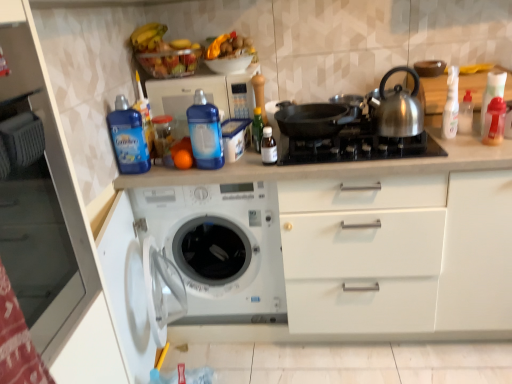
Question: Is blue plastic microwave at upper center taller than black matte pan at center?

Choices:
 (A) no
 (B) yes

Answer: (B)

Question: Considering the relative sizes of blue plastic microwave at upper center and black matte pan at center in the image provided, is blue plastic microwave at upper center bigger than black matte pan at center?

Choices:
 (A) no
 (B) yes

Answer: (B)

Question: Is blue plastic microwave at upper center placed right next to black matte pan at center?

Choices:
 (A) no
 (B) yes

Answer: (A)

Question: From the image's perspective, does blue plastic microwave at upper center appear lower than black matte pan at center?

Choices:
 (A) yes
 (B) no

Answer: (B)

Question: Is blue plastic microwave at upper center aimed at black matte pan at center?

Choices:
 (A) yes
 (B) no

Answer: (B)

Question: From the image's perspective, is shiny metallic kettle at upper right above or below black matte frying pan at center?

Choices:
 (A) above
 (B) below

Answer: (A)

Question: Is point tap(388, 110) positioned closer to the camera than point tap(297, 122)?

Choices:
 (A) farther
 (B) closer

Answer: (B)

Question: Looking at the image, does shiny metallic kettle at upper right seem bigger or smaller compared to black matte frying pan at center?

Choices:
 (A) small
 (B) big

Answer: (A)

Question: Considering the positions of shiny metallic kettle at upper right and black matte frying pan at center in the image, is shiny metallic kettle at upper right taller or shorter than black matte frying pan at center?

Choices:
 (A) short
 (B) tall

Answer: (B)

Question: Is transparent plastic bottle at center, which is counted as the 5th bottle, starting from the left, taller or shorter than orange matte at center?

Choices:
 (A) tall
 (B) short

Answer: (A)

Question: From the image's perspective, is transparent plastic bottle at center, which is counted as the 5th bottle, starting from the left, above or below orange matte at center?

Choices:
 (A) above
 (B) below

Answer: (A)

Question: Looking at their shapes, would you say transparent plastic bottle at center, the 4th bottle in the right-to-left sequence, is wider or thinner than orange matte at center?

Choices:
 (A) thin
 (B) wide

Answer: (A)

Question: In the image, is transparent plastic bottle at center, the 4th bottle in the right-to-left sequence, on the left side or the right side of orange matte at center?

Choices:
 (A) right
 (B) left

Answer: (A)

Question: In terms of width, does shiny metallic kettle at upper right look wider or thinner when compared to blue plastic microwave at upper center?

Choices:
 (A) wide
 (B) thin

Answer: (B)

Question: In terms of size, does shiny metallic kettle at upper right appear bigger or smaller than blue plastic microwave at upper center?

Choices:
 (A) small
 (B) big

Answer: (A)